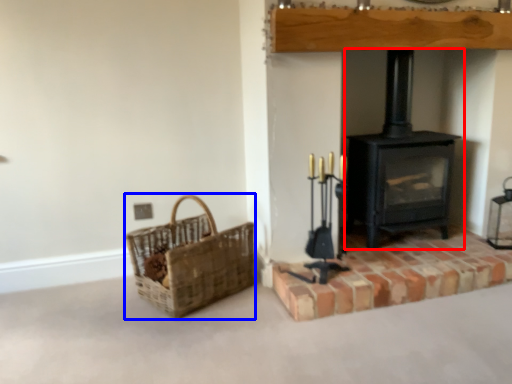
Question: Which object is further to the camera taking this photo, wood burning stove (highlighted by a red box) or basket (highlighted by a blue box)?

Choices:
 (A) wood burning stove
 (B) basket

Answer: (A)